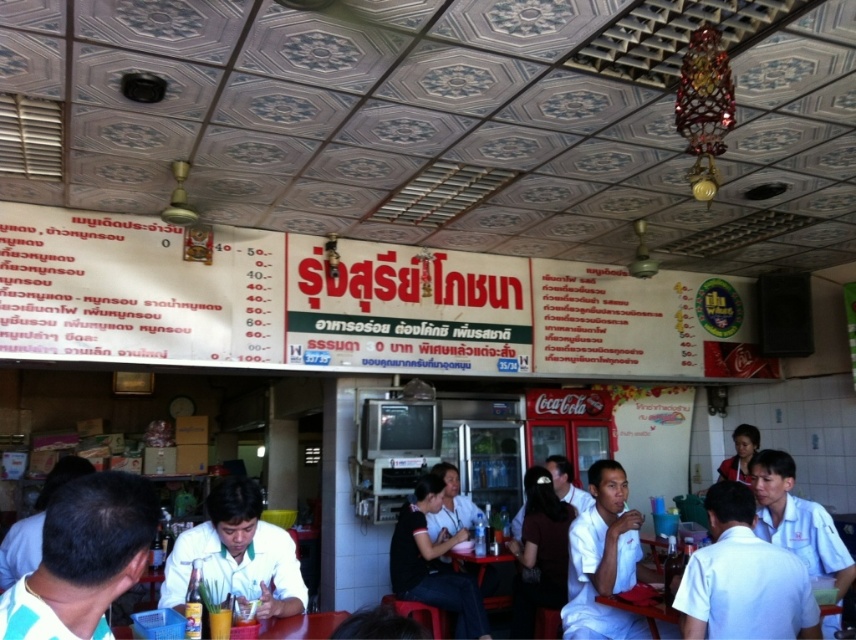
Question: Which object is the closest to the black matte shirt at center?

Choices:
 (A) white matte shirt at center
 (B) white cotton shirt at center

Answer: (A)

Question: Does white uniform shirt at right appear on the left side of matte black shirt at center?

Choices:
 (A) yes
 (B) no

Answer: (B)

Question: Can you confirm if white cotton shirt at center is bigger than black matte shirt at center?

Choices:
 (A) no
 (B) yes

Answer: (A)

Question: Which object is the closest to the white cotton shirt at center?

Choices:
 (A) white matte shirt at center
 (B) black matte shirt at center
 (C) white uniform shirt at right
 (D) white shirt at upper right

Answer: (C)

Question: Which point is farther from the camera taking this photo?

Choices:
 (A) (712, 589)
 (B) (827, 548)

Answer: (B)

Question: Can you confirm if white matte shirt at lower left is positioned to the left of white uniform shirt at center?

Choices:
 (A) yes
 (B) no

Answer: (B)